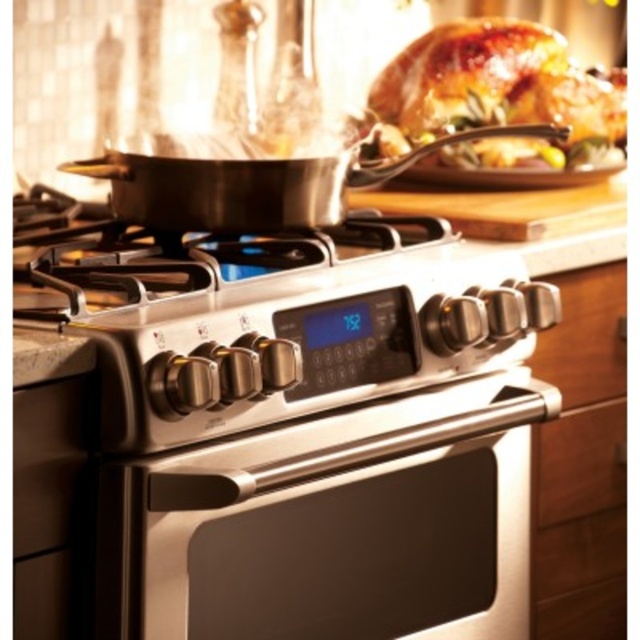
You are standing in the kitchen and want to reach the point marked as point (204, 579). Can you estimate how far you need to move forward to reach it?

The point (204, 579) is 3.41 feet away from the viewer, so you need to move forward approximately 3.41 feet to reach it.